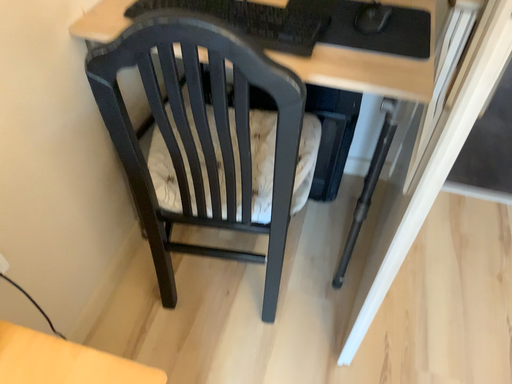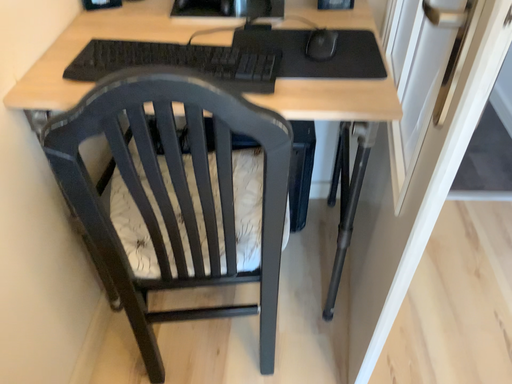
Question: Which way did the camera rotate in the video?

Choices:
 (A) rotated left
 (B) rotated right

Answer: (B)